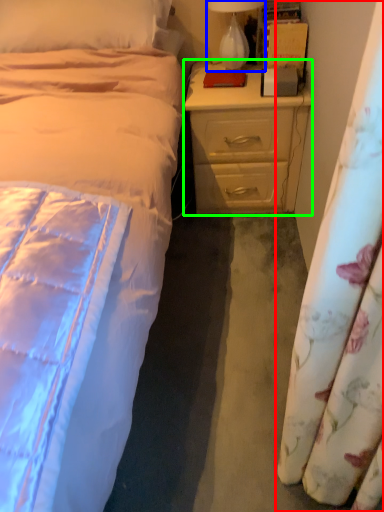
Question: Estimate the real-world distances between objects in this image. Which object is farther from curtain (highlighted by a red box), lamp (highlighted by a blue box) or nightstand (highlighted by a green box)?

Choices:
 (A) lamp
 (B) nightstand

Answer: (A)